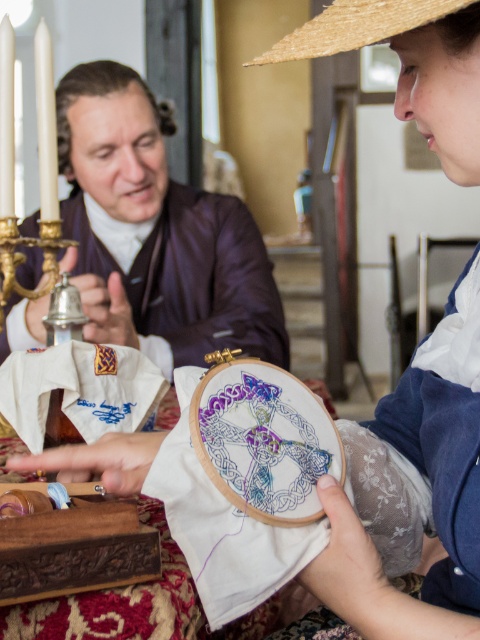
Question: Observing the image, what is the correct spatial positioning of purple silk jacket at upper center in reference to straw hat at upper center?

Choices:
 (A) above
 (B) below

Answer: (A)

Question: Which of the following is the farthest from the observer?

Choices:
 (A) straw hat at upper center
 (B) purple silk jacket at upper center

Answer: (B)

Question: Which object is farther from the camera taking this photo?

Choices:
 (A) purple silk jacket at upper center
 (B) straw hat at upper center

Answer: (A)

Question: Can you confirm if purple silk jacket at upper center is positioned to the left of straw hat at upper center?

Choices:
 (A) no
 (B) yes

Answer: (B)

Question: Can you confirm if purple silk jacket at upper center is positioned above straw hat at upper center?

Choices:
 (A) yes
 (B) no

Answer: (A)